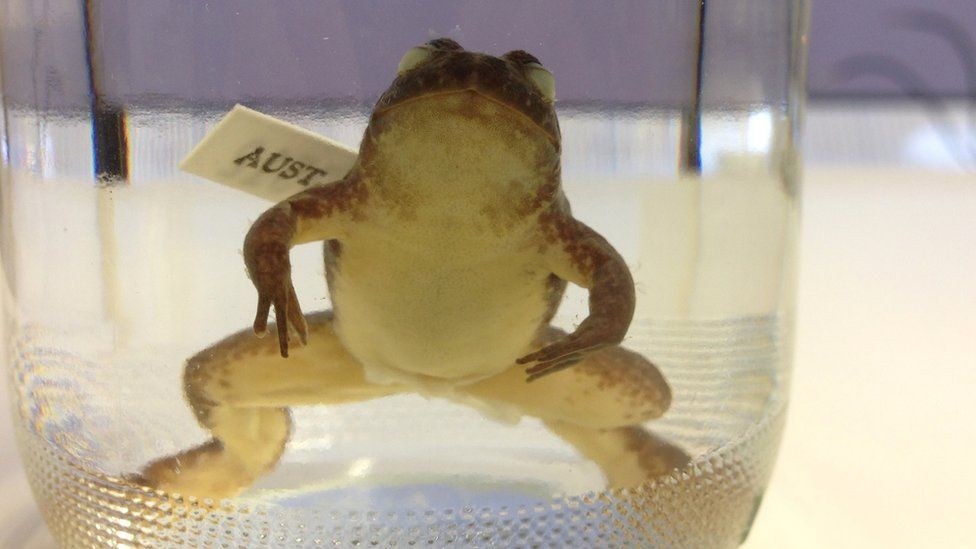
You are a GUI agent. You are given a task and a screenshot of the screen. Output one action in this format:
    pyautogui.click(x=<x>, y=<y>)
    Task: Click on the clear jar
    The height and width of the screenshot is (549, 976).
    Given the screenshot: What is the action you would take?
    pyautogui.click(x=774, y=77)